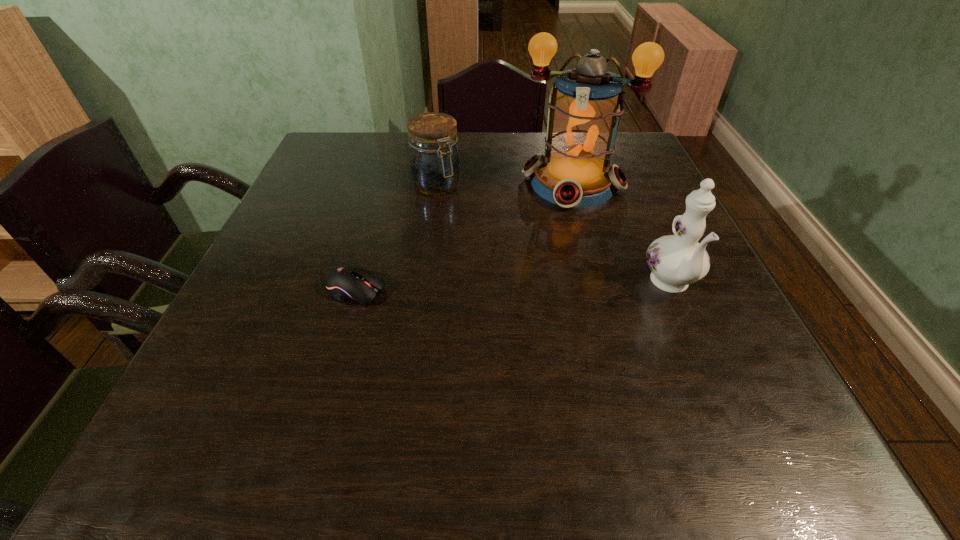
Where is `vacant space on the desktop that is between the shortest object and the third shortest object and is positioned on the front-facing side of the tallest object`? The height and width of the screenshot is (540, 960). vacant space on the desktop that is between the shortest object and the third shortest object and is positioned on the front-facing side of the tallest object is located at coordinates (540, 287).

What are the coordinates of `free space on the desktop that is between the computer mouse and the chinaware and is positioned on the lid of the second shortest object` in the screenshot? It's located at (526, 288).